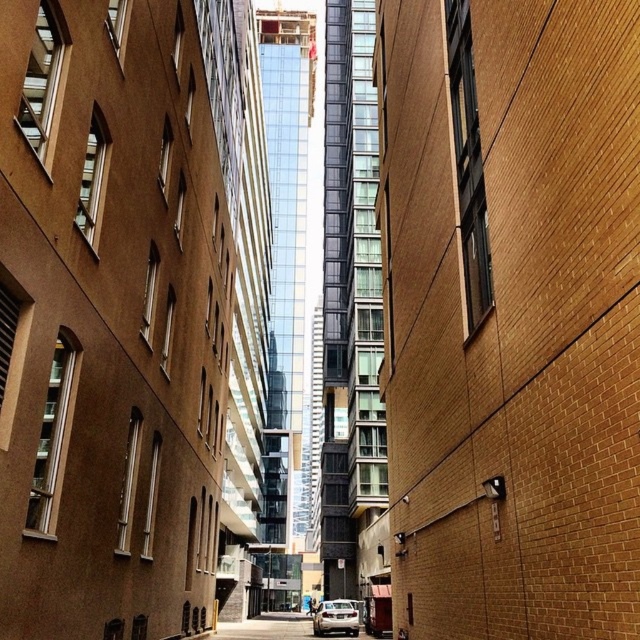
You are a delivery person trying to park your silver metallic car at lower center in the narrow alley. There is a brown brick wall at center above your car. Is there enough vertical space for you to park your car without hitting the wall?

The brown brick wall at center is above the silver metallic car at lower center, so there is enough vertical space for the car to park without hitting the wall since the wall is positioned higher up.

You are a delivery person trying to park your silver metallic car at lower center in the narrow alley. The alley has a brown brick wall at center. Considering the height of the objects, will the car fit without touching the wall?

The brown brick wall at center has a lesser height compared to the silver metallic car at lower center, so the car will not touch the wall when parked in the alley.